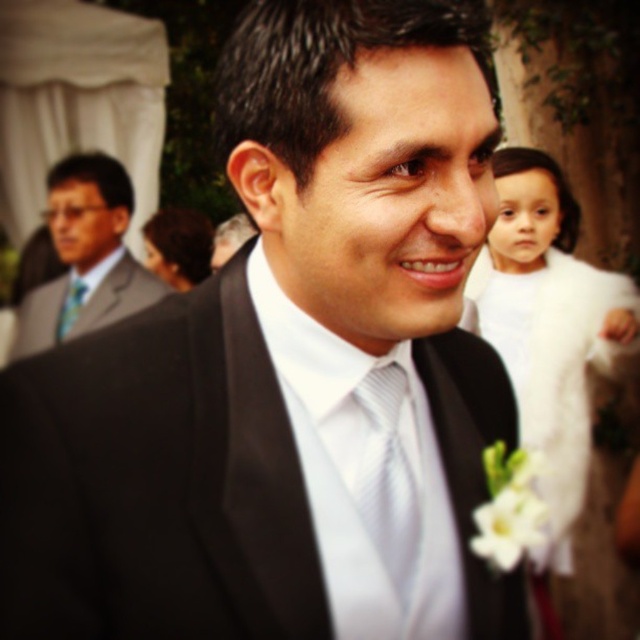
From the picture: Does white fluffy dress at right appear on the left side of matte black tie at center?

In fact, white fluffy dress at right is to the right of matte black tie at center.

Who is more forward, (561, 237) or (60, 316)?

Point (561, 237)

Is point (474, 323) closer to camera compared to point (70, 285)?

Yes, point (474, 323) is in front of point (70, 285).

Find the location of a particular element. Image resolution: width=640 pixels, height=640 pixels. white fluffy dress at right is located at coordinates tap(550, 336).

Can you confirm if matte black suit at left is positioned to the right of matte silver tie at center?

No, matte black suit at left is not to the right of matte silver tie at center.

What do you see at coordinates (84, 257) in the screenshot? The height and width of the screenshot is (640, 640). I see `matte black suit at left` at bounding box center [84, 257].

At what (x,y) coordinates should I click in order to perform the action: click on matte black suit at left. Please return your answer as a coordinate pair (x, y). This screenshot has height=640, width=640. Looking at the image, I should click on (84, 257).

From the picture: Does matte silver tie at center appear over matte black tie at center?

No, matte silver tie at center is not above matte black tie at center.

Between point (394, 444) and point (61, 333), which one is positioned in front?

Point (394, 444) is more forward.

Between point (378, 477) and point (67, 304), which one is positioned in front?

Point (378, 477) is more forward.

Locate an element on the screen. The image size is (640, 640). matte silver tie at center is located at coordinates (387, 477).